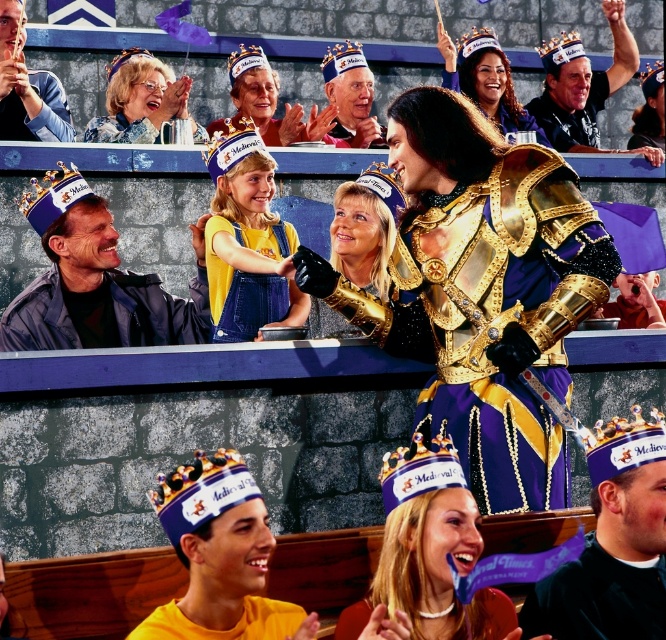
You are a participant at the medieval event and need to choose a crown to wear. The organizers require that the crown you select must be wider than the other available crown. Which crown should you choose between the matte blue crown at upper left and the matte purple crown at upper center?

The matte blue crown at upper left is wider than the matte purple crown at upper center, so you should choose the matte blue crown at upper left to meet the requirement.

You are a guest at the Medieval Times event and notice two crowns in the image. The matte blue crown at upper left and the matte purple crown at upper center. Which crown is closer to you?

The matte blue crown at upper left is closer to you because it is in front of the matte purple crown at upper center.